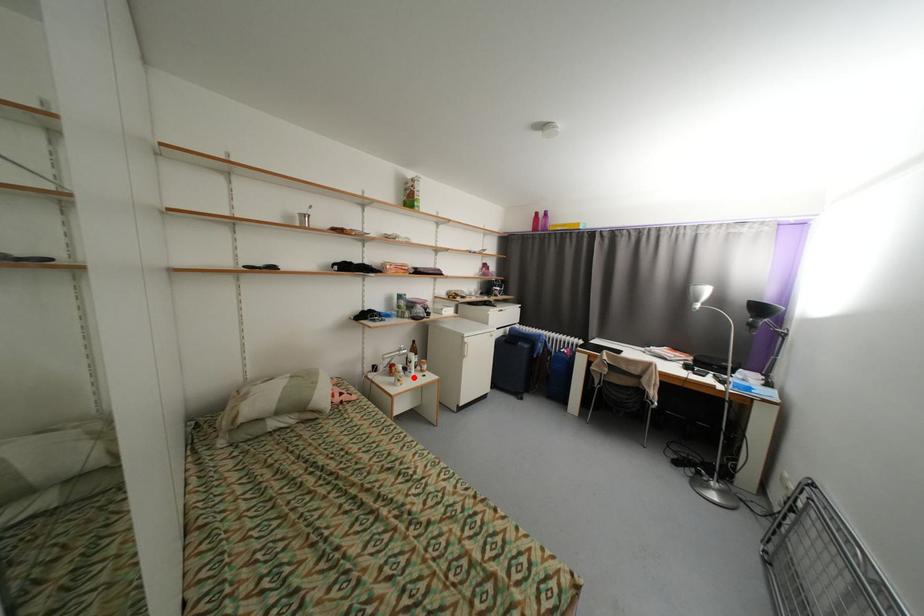
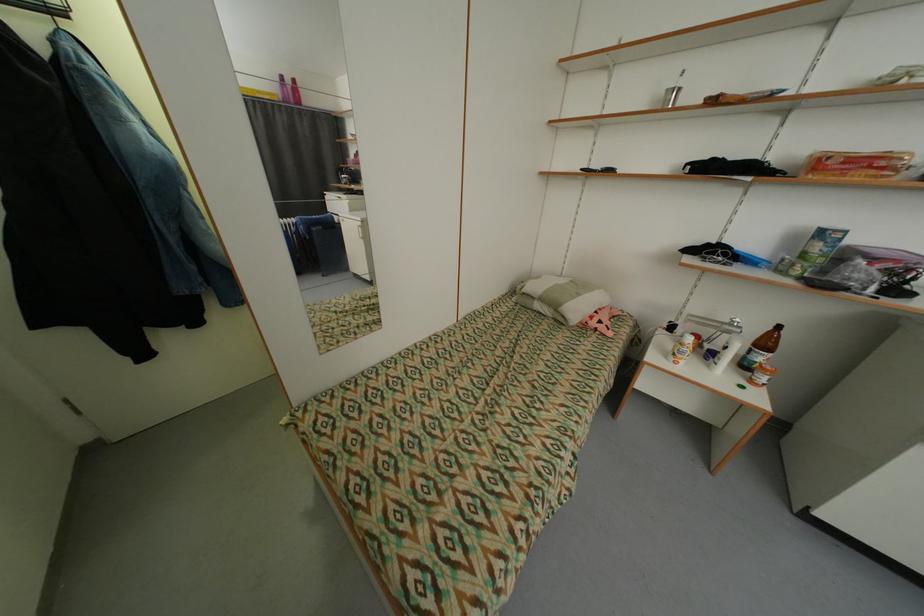
Question: I am providing you with two images of the same scene from different viewpoints. In image1, a red point is highlighted. Considering the same 3D point in image2, which of the following is correct?

Choices:
 (A) It is closer
 (B) It is farther

Answer: (A)